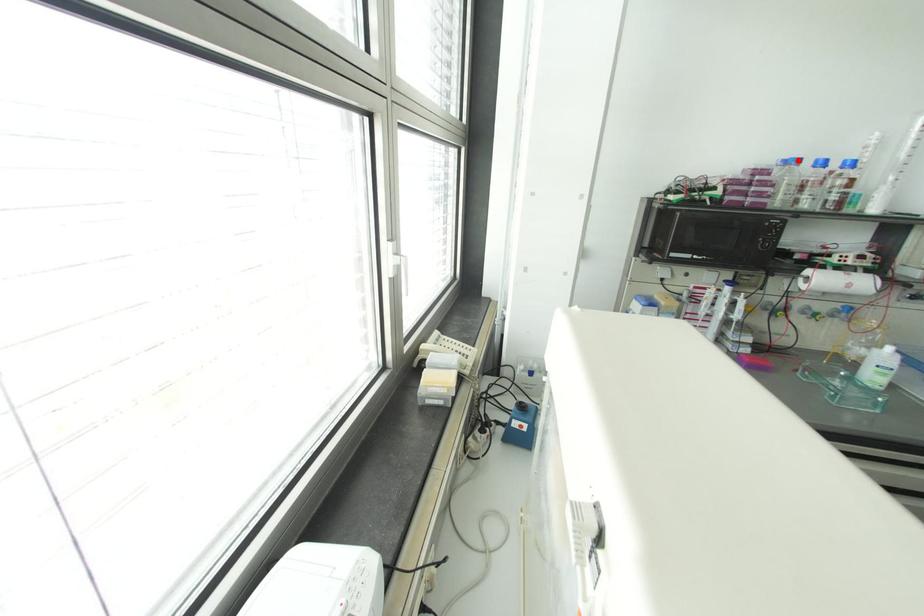
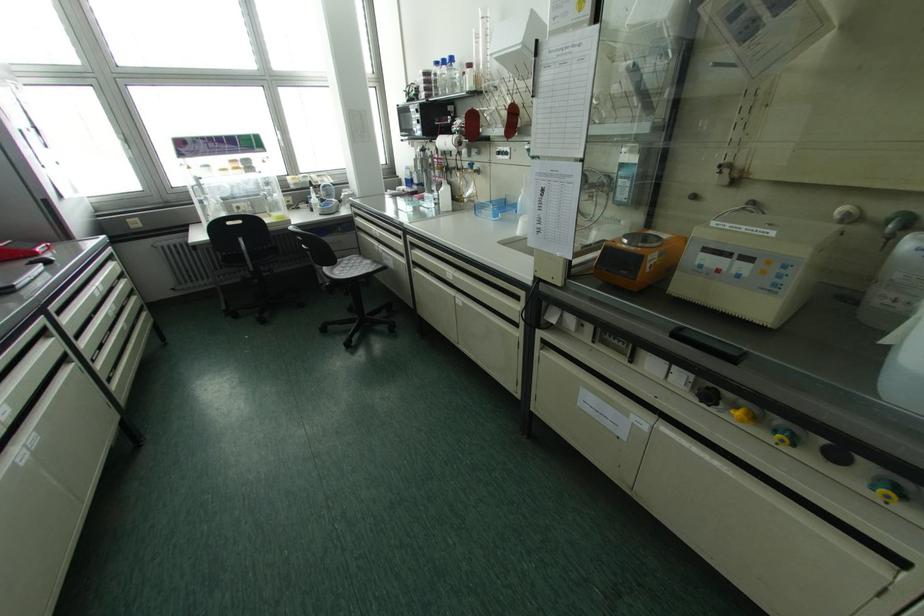
Question: I am providing you with two images of the same scene from different viewpoints. In image1, a red point is highlighted. Considering the same 3D point in image2, which of the following is correct?

Choices:
 (A) It is closer
 (B) It is farther

Answer: (A)